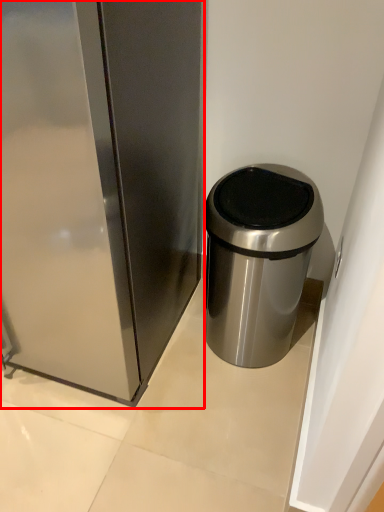
Question: In this image, where is appliance (annotated by the red box) located relative to waste container?

Choices:
 (A) left
 (B) right

Answer: (A)